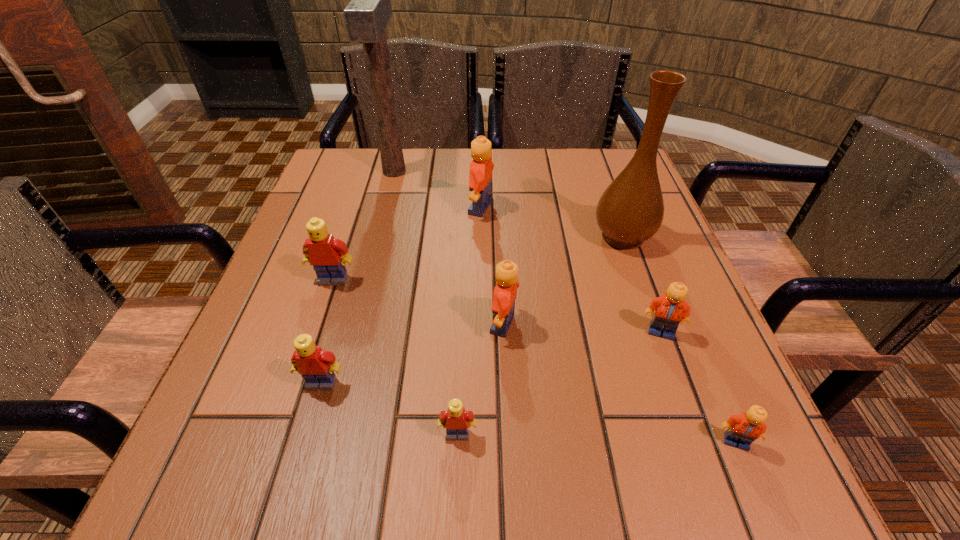
Select which object appears as the third closest to the sixth nearest Lego. Please provide its 2D coordinates. Your answer should be formatted as a tuple, i.e. [(x, y)], where the tuple contains the x and y coordinates of a point satisfying the conditions above.

[(480, 176)]

Where is `Lego that is the fifth closest one to the vase`? The width and height of the screenshot is (960, 540). Lego that is the fifth closest one to the vase is located at coordinates (455, 419).

Identify the location of Lego that is the third closest to the third nearest object. This screenshot has height=540, width=960. (505, 292).

Identify the location of orange Lego that can be found as the third closest to the rightmost yellow Lego. This screenshot has height=540, width=960. (743, 429).

Choose which orange Lego is the nearest neighbor to the smallest yellow Lego. Please provide its 2D coordinates. Your answer should be formatted as a tuple, i.e. [(x, y)], where the tuple contains the x and y coordinates of a point satisfying the conditions above.

[(505, 292)]

Where is `yellow Lego that is the third closest to the second smallest orange Lego`? The image size is (960, 540). yellow Lego that is the third closest to the second smallest orange Lego is located at coordinates (323, 252).

The height and width of the screenshot is (540, 960). What are the coordinates of `yellow Lego object that ranks as the third closest to the biggest orange Lego` in the screenshot? It's located at (455, 419).

Locate an element on the screen. The image size is (960, 540). blank space that satisfies the following two spatial constraints: 1. on the front-facing side of the farthest orange Lego; 2. on the front-facing side of the sixth nearest object is located at coordinates (481, 280).